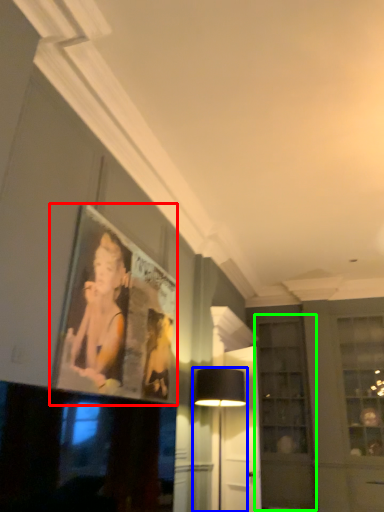
Question: Estimate the real-world distances between objects in this image. Which object is closer to picture frame (highlighted by a red box), table lamp (highlighted by a blue box) or glass door (highlighted by a green box)?

Choices:
 (A) table lamp
 (B) glass door

Answer: (A)